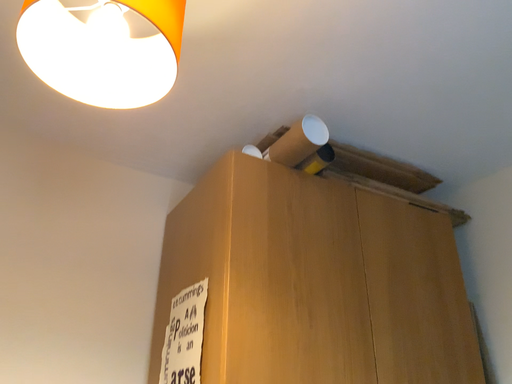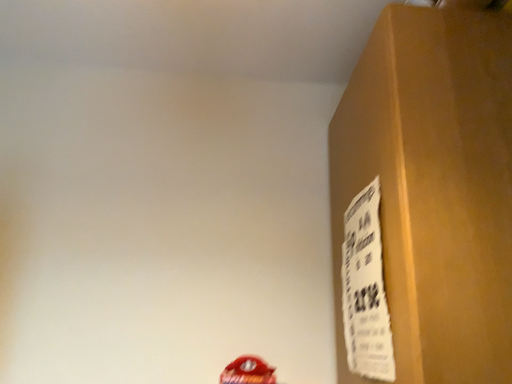
Question: Which way did the camera rotate in the video?

Choices:
 (A) rotated left
 (B) rotated right

Answer: (A)